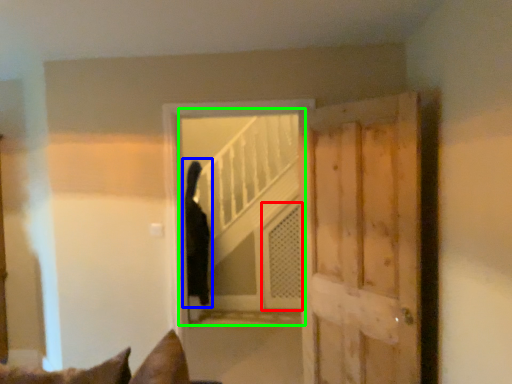
Question: Estimate the real-world distances between objects in this image. Which object is closer to screen door (highlighted by a red box), cat (highlighted by a blue box) or elevator (highlighted by a green box)?

Choices:
 (A) cat
 (B) elevator

Answer: (B)